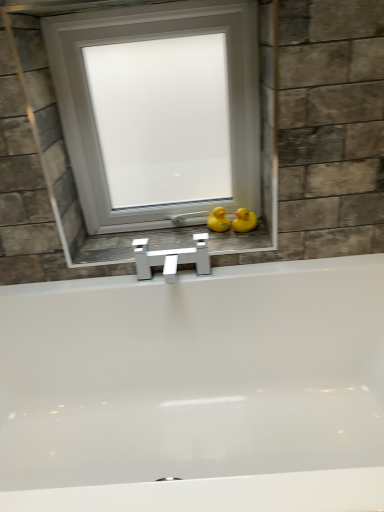
This screenshot has height=512, width=384. What are the coordinates of `vacant point above white glossy faucet at center (from a real-world perspective)` in the screenshot? It's located at (173, 241).